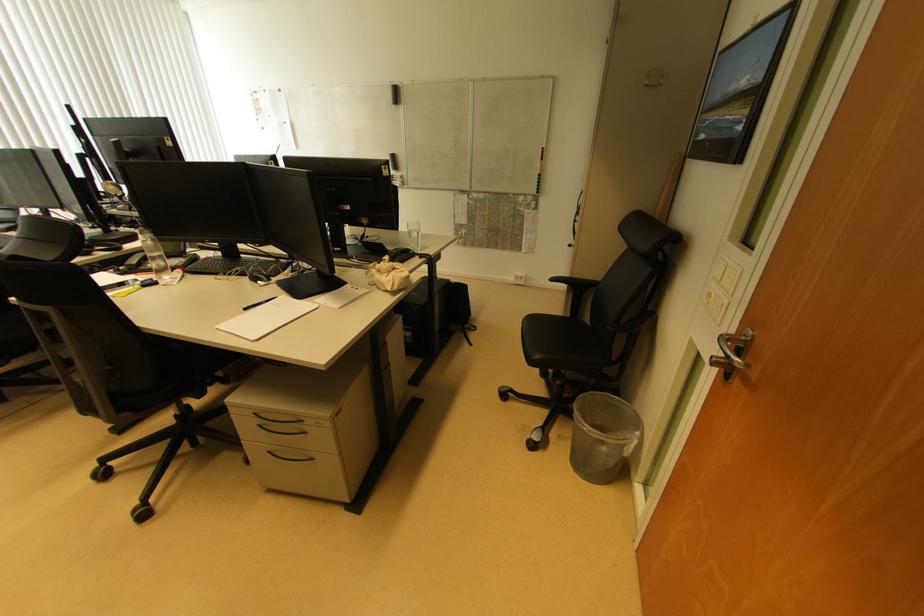
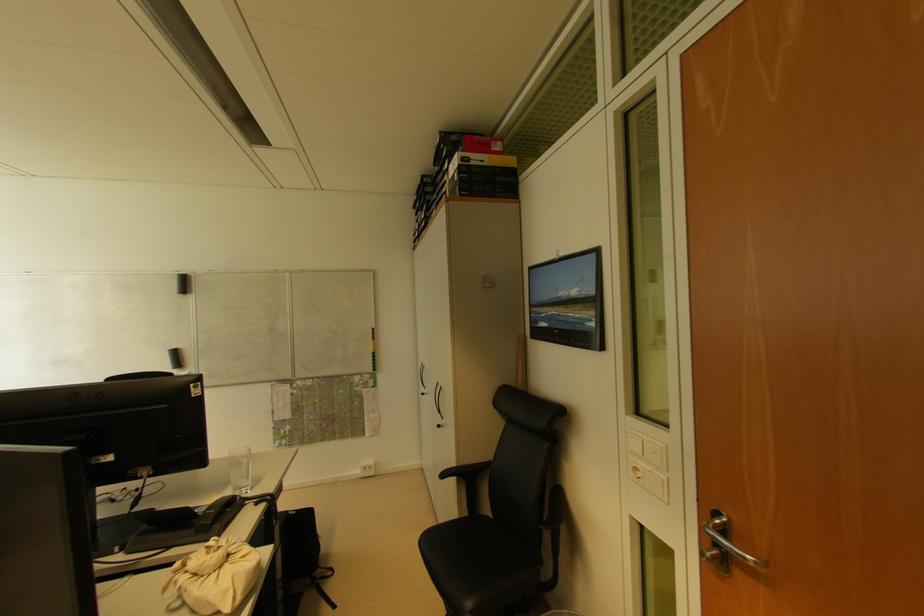
Find the pixel in the second image that matches pixel 398 98 in the first image.

(187, 286)